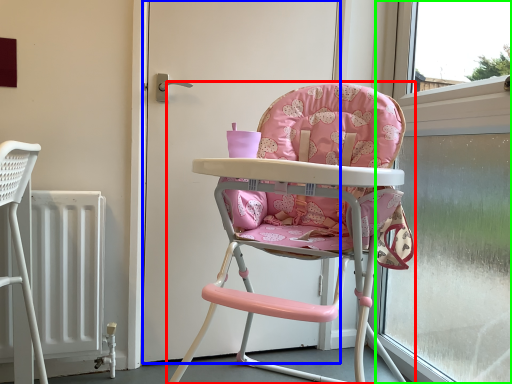
Question: Based on their relative distances, which object is farther from chair (highlighted by a red box)? Choose from door (highlighted by a blue box) and window frame (highlighted by a green box).

Choices:
 (A) door
 (B) window frame

Answer: (B)